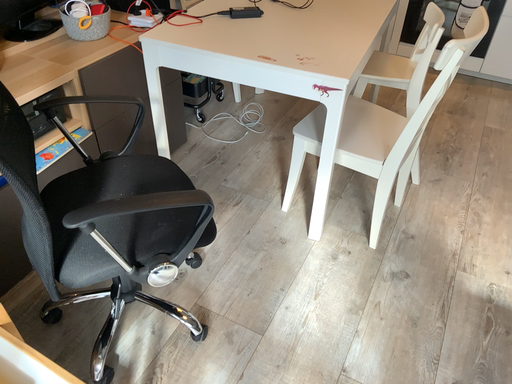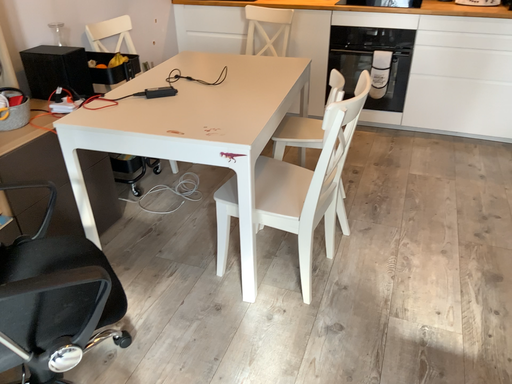
Question: Which way did the camera rotate in the video?

Choices:
 (A) rotated upward
 (B) rotated downward

Answer: (A)